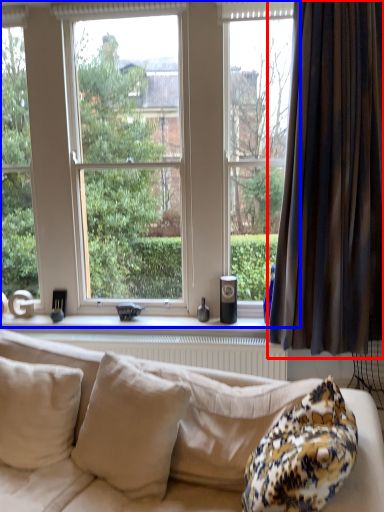
Question: Which point is closer to the camera, curtain (highlighted by a red box) or window (highlighted by a blue box)?

Choices:
 (A) curtain
 (B) window

Answer: (A)